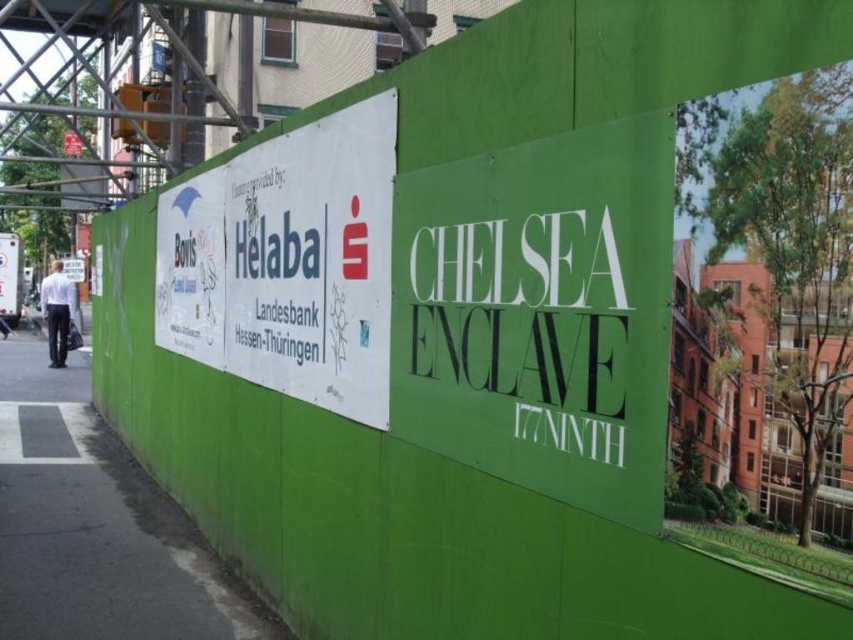
You are a delivery driver who needs to find the entrance to the Chelsea Enclave 177MTH construction site. You see the white paper sign at center and the green asphalt pavement at lower left. Which object is covering the other?

The white paper sign at center is positioned over the green asphalt pavement at lower left, so the white paper sign at center is covering the green asphalt pavement at lower left.

You are a delivery driver arriving at the construction site and need to park your vehicle. The parking area is marked by the green asphalt pavement at lower left. There is a green matte sign at center nearby. Which object is wider so you can identify the parking area?

The green asphalt pavement at lower left is wider than the green matte sign at center, so the parking area is marked by the green asphalt pavement at lower left.